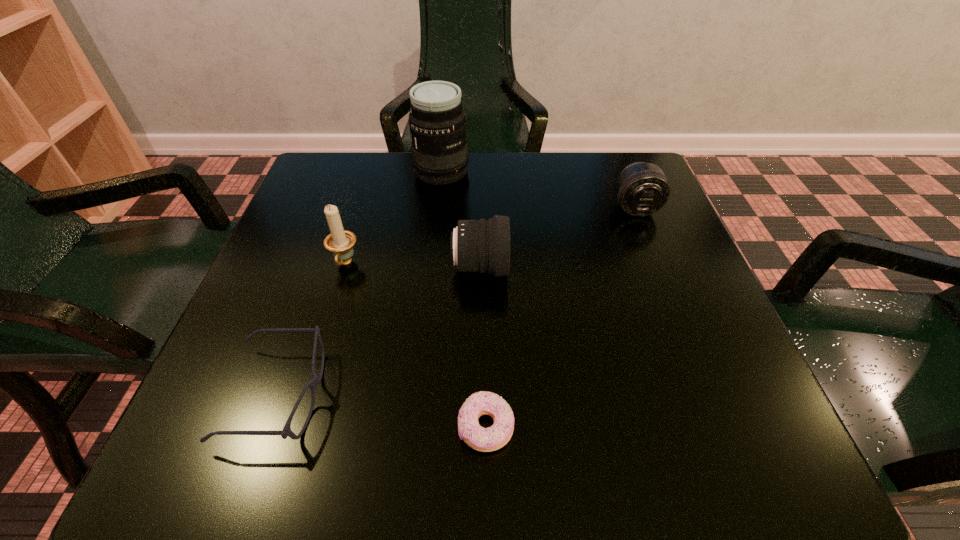
Locate which telephoto lens is the closest to the nearest telephoto lens. Please provide its 2D coordinates. Your answer should be formatted as a tuple, i.e. [(x, y)], where the tuple contains the x and y coordinates of a point satisfying the conditions above.

[(437, 123)]

Where is `vacant space that satisfies the following two spatial constraints: 1. on the front-facing side of the doughnut; 2. on the left side of the fifth tallest object`? vacant space that satisfies the following two spatial constraints: 1. on the front-facing side of the doughnut; 2. on the left side of the fifth tallest object is located at coordinates (267, 428).

Where is `free space in the image that satisfies the following two spatial constraints: 1. on the handle side of the doughnut; 2. on the right side of the fifth shortest object`? The height and width of the screenshot is (540, 960). free space in the image that satisfies the following two spatial constraints: 1. on the handle side of the doughnut; 2. on the right side of the fifth shortest object is located at coordinates (296, 428).

Find the location of `free spot that satisfies the following two spatial constraints: 1. at the front element of the shortest object; 2. on the right side of the nearest telephoto lens`. free spot that satisfies the following two spatial constraints: 1. at the front element of the shortest object; 2. on the right side of the nearest telephoto lens is located at coordinates (480, 428).

This screenshot has height=540, width=960. Identify the location of vacant point that satisfies the following two spatial constraints: 1. on the handle side of the second tallest object; 2. on the right side of the shortest object. (296, 428).

This screenshot has height=540, width=960. I want to click on free space in the image that satisfies the following two spatial constraints: 1. on the handle side of the fifth shortest object; 2. on the front-facing side of the fifth tallest object, so click(305, 395).

Where is `vacant area that satisfies the following two spatial constraints: 1. on the front-facing side of the second shortest object; 2. on the back side of the shortest object`? The height and width of the screenshot is (540, 960). vacant area that satisfies the following two spatial constraints: 1. on the front-facing side of the second shortest object; 2. on the back side of the shortest object is located at coordinates (267, 428).

At what (x,y) coordinates should I click in order to perform the action: click on blank space that satisfies the following two spatial constraints: 1. on the handle side of the candle_holder; 2. on the front-facing side of the fifth tallest object. Please return your answer as a coordinate pair (x, y). The height and width of the screenshot is (540, 960). Looking at the image, I should click on (305, 395).